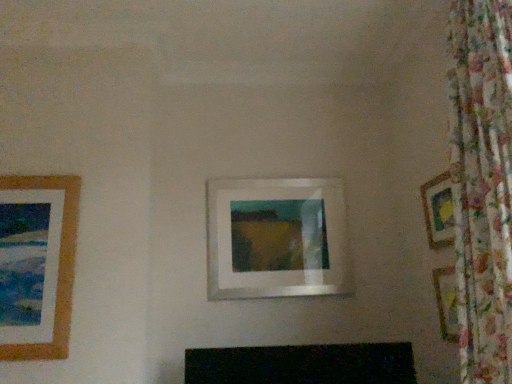
Question: Considering the relative sizes of white matte picture frame at center, which appears as the second picture frame when viewed from the left, and brown wooden picture frame at left, which is the first picture frame from left to right, in the image provided, is white matte picture frame at center, which appears as the second picture frame when viewed from the left, taller than brown wooden picture frame at left, which is the first picture frame from left to right,?

Choices:
 (A) yes
 (B) no

Answer: (B)

Question: Is brown wooden picture frame at left, which is the third picture frame in right-to-left order, at the back of white matte picture frame at center, the 2th picture frame viewed from the right?

Choices:
 (A) yes
 (B) no

Answer: (B)

Question: Is white matte picture frame at center, the 2th picture frame viewed from the right, outside of brown wooden picture frame at left, which is the first picture frame from left to right?

Choices:
 (A) no
 (B) yes

Answer: (B)

Question: Can you confirm if white matte picture frame at center, which appears as the second picture frame when viewed from the left, is bigger than brown wooden picture frame at left, which is the third picture frame in right-to-left order?

Choices:
 (A) yes
 (B) no

Answer: (A)

Question: Is white matte picture frame at center, which appears as the second picture frame when viewed from the left, at the right side of brown wooden picture frame at left, which is the first picture frame from left to right?

Choices:
 (A) yes
 (B) no

Answer: (A)

Question: Considering the relative positions of brown wooden picture frame at left, which is the first picture frame from left to right, and white matte picture frame at center, the 2th picture frame viewed from the right, in the image provided, is brown wooden picture frame at left, which is the first picture frame from left to right, to the left or to the right of white matte picture frame at center, the 2th picture frame viewed from the right,?

Choices:
 (A) right
 (B) left

Answer: (B)

Question: From a real-world perspective, is brown wooden picture frame at left, which is the first picture frame from left to right, above or below white matte picture frame at center, which appears as the second picture frame when viewed from the left?

Choices:
 (A) above
 (B) below

Answer: (B)

Question: Considering the positions of brown wooden picture frame at left, which is the third picture frame in right-to-left order, and white matte picture frame at center, the 2th picture frame viewed from the right, in the image, is brown wooden picture frame at left, which is the third picture frame in right-to-left order, wider or thinner than white matte picture frame at center, the 2th picture frame viewed from the right,?

Choices:
 (A) wide
 (B) thin

Answer: (B)

Question: Considering the positions of brown wooden picture frame at left, which is the first picture frame from left to right, and white matte picture frame at center, which appears as the second picture frame when viewed from the left, in the image, is brown wooden picture frame at left, which is the first picture frame from left to right, taller or shorter than white matte picture frame at center, which appears as the second picture frame when viewed from the left,?

Choices:
 (A) tall
 (B) short

Answer: (A)

Question: Is white matte picture frame at center, the 2th picture frame viewed from the right, taller or shorter than wooden picture frame at right, which appears as the first picture frame when viewed from the right?

Choices:
 (A) tall
 (B) short

Answer: (A)

Question: From a real-world perspective, is white matte picture frame at center, which appears as the second picture frame when viewed from the left, physically located above or below wooden picture frame at right, which ranks as the third picture frame in left-to-right order?

Choices:
 (A) above
 (B) below

Answer: (B)

Question: Do you think white matte picture frame at center, which appears as the second picture frame when viewed from the left, is within wooden picture frame at right, which appears as the first picture frame when viewed from the right, or outside of it?

Choices:
 (A) outside
 (B) inside

Answer: (A)

Question: In the image, is white matte picture frame at center, the 2th picture frame viewed from the right, on the left side or the right side of wooden picture frame at right, which ranks as the third picture frame in left-to-right order?

Choices:
 (A) right
 (B) left

Answer: (B)

Question: Considering the positions of wooden picture frame at right, which ranks as the third picture frame in left-to-right order, and white matte picture frame at center, which appears as the second picture frame when viewed from the left, in the image, is wooden picture frame at right, which ranks as the third picture frame in left-to-right order, bigger or smaller than white matte picture frame at center, which appears as the second picture frame when viewed from the left,?

Choices:
 (A) big
 (B) small

Answer: (B)

Question: Considering the positions of wooden picture frame at right, which appears as the first picture frame when viewed from the right, and white matte picture frame at center, which appears as the second picture frame when viewed from the left, in the image, is wooden picture frame at right, which appears as the first picture frame when viewed from the right, wider or thinner than white matte picture frame at center, which appears as the second picture frame when viewed from the left,?

Choices:
 (A) thin
 (B) wide

Answer: (A)